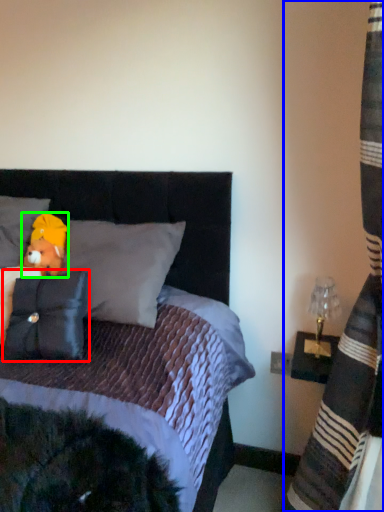
Question: Which object is the farthest from pillow (highlighted by a red box)? Choose among these: curtain (highlighted by a blue box) or figurine (highlighted by a green box).

Choices:
 (A) curtain
 (B) figurine

Answer: (A)